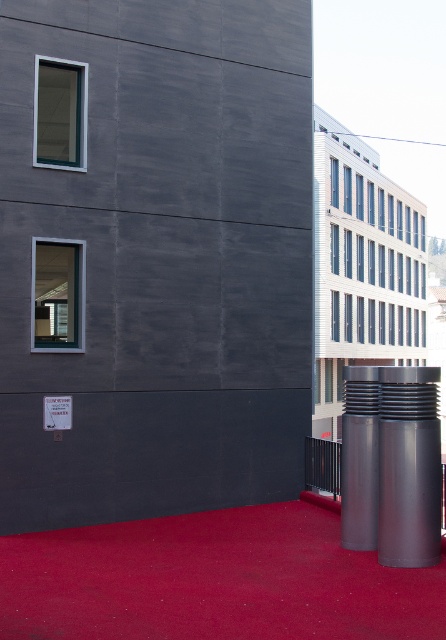
You are a city planner assessing the central plaza. You notice the polished metallic cylinder at center and the silver metallic pillar at center. Which object is located above the other?

The polished metallic cylinder at center is positioned over the silver metallic pillar at center.

You are a delivery person needing to place a large box between the polished metallic cylinder at center and the silver metallic pillar at center. Which object should you position the box closer to if you want to maximize the space available for the box?

The polished metallic cylinder at center is smaller than the silver metallic pillar at center, so positioning the box closer to the polished metallic cylinder at center will allow more space for the box.

You are a city planner assessing the central square. You need to install a new streetlight that must be shorter than the existing silver metallic pillar at center. Based on the image, can the polished metallic cylinder at center serve as the new streetlight?

The polished metallic cylinder at center is not as tall as the silver metallic pillar at center, so it can serve as the new streetlight since it meets the requirement of being shorter.